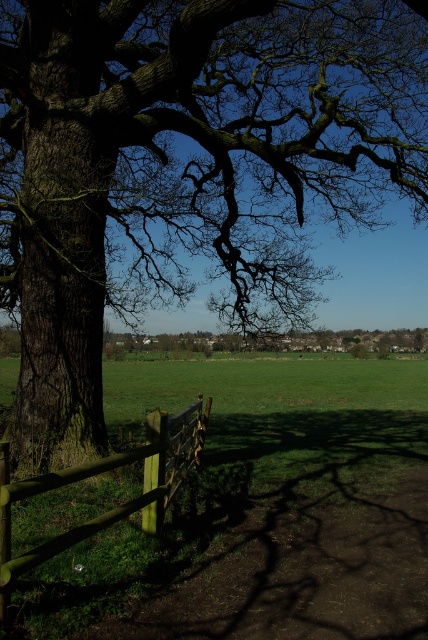
Question: Which object is farther from the camera taking this photo?

Choices:
 (A) dark brown textured oak tree at left
 (B) wooden fence at lower left

Answer: (B)

Question: Which object is closer to the camera taking this photo?

Choices:
 (A) dark brown textured oak tree at left
 (B) wooden fence at lower left

Answer: (A)

Question: Where is dark brown textured oak tree at left located in relation to wooden fence at lower left in the image?

Choices:
 (A) above
 (B) below

Answer: (A)

Question: Is the position of dark brown textured oak tree at left less distant than that of wooden fence at lower left?

Choices:
 (A) no
 (B) yes

Answer: (B)

Question: Is dark brown textured oak tree at left smaller than wooden fence at lower left?

Choices:
 (A) no
 (B) yes

Answer: (A)